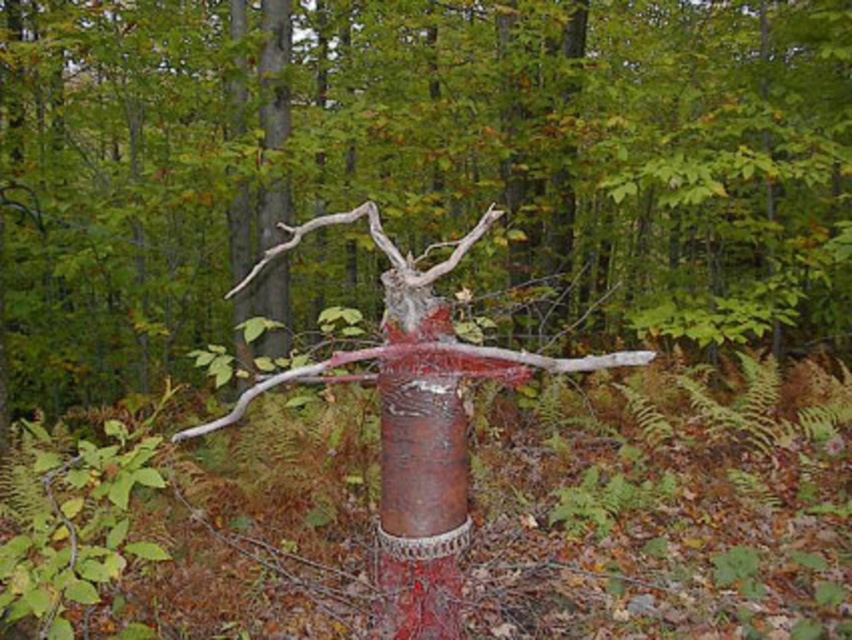
The image size is (852, 640). What do you see at coordinates (421, 499) in the screenshot?
I see `rusty metal pole at center` at bounding box center [421, 499].

Identify the location of rusty metal pole at center. (421, 499).

You are a GUI agent. You are given a task and a screenshot of the screen. Output one action in this format:
    pyautogui.click(x=<x>, y=<y>)
    Task: Click on the rusty metal pole at center
    The height and width of the screenshot is (640, 852).
    Given the screenshot: What is the action you would take?
    (421, 499)

Who is taller, rusty metal tree at center or rusty metal pole at center?

With more height is rusty metal pole at center.

Between rusty metal tree at center and rusty metal pole at center, which one appears on the left side from the viewer's perspective?

From the viewer's perspective, rusty metal pole at center appears more on the left side.

The image size is (852, 640). In order to click on rusty metal tree at center in this screenshot , I will do `click(417, 168)`.

Which is more to the left, rusty metal tree at center or rusty metal branch at center?

rusty metal branch at center

Can you confirm if rusty metal tree at center is smaller than rusty metal branch at center?

Yes, rusty metal tree at center is smaller than rusty metal branch at center.

Locate an element on the screen. The height and width of the screenshot is (640, 852). rusty metal tree at center is located at coordinates (417, 168).